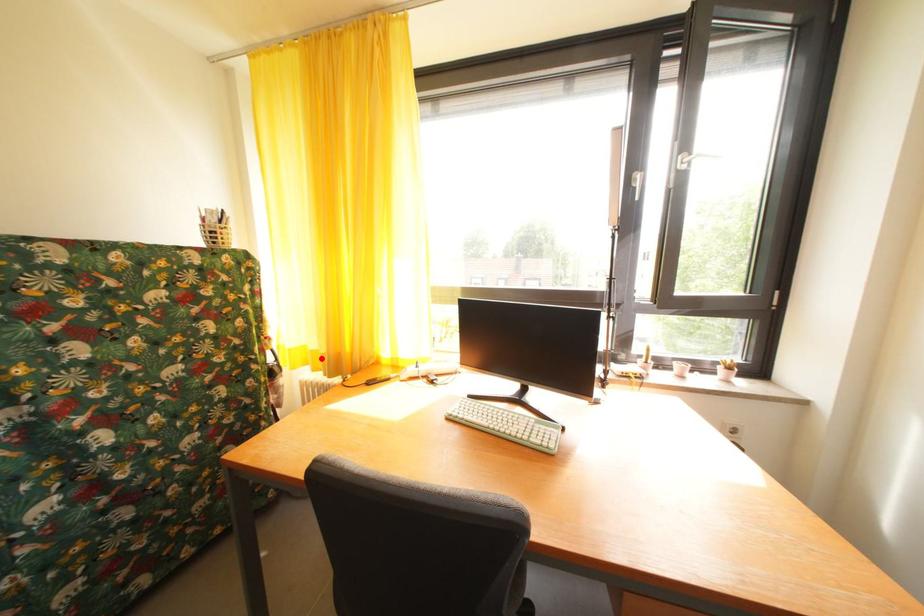
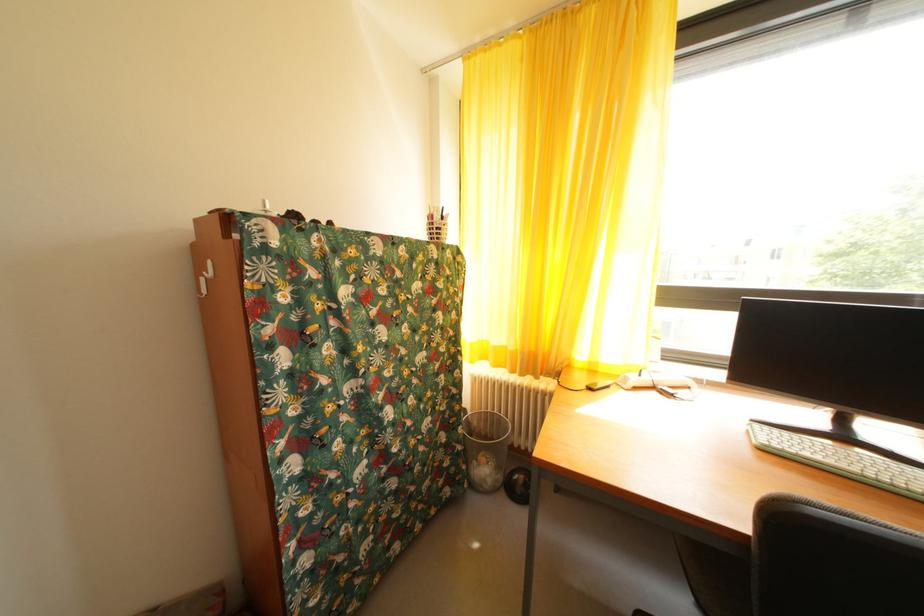
In the second image, find the point that corresponds to the highlighted location in the first image.

(505, 354)